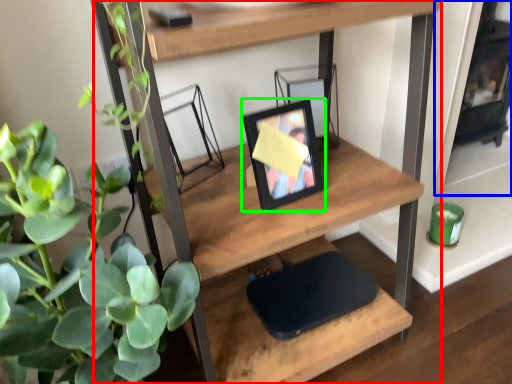
Question: Estimate the real-world distances between objects in this image. Which object is closer to shelf (highlighted by a red box), fireplace (highlighted by a blue box) or picture frame (highlighted by a green box)?

Choices:
 (A) fireplace
 (B) picture frame

Answer: (B)